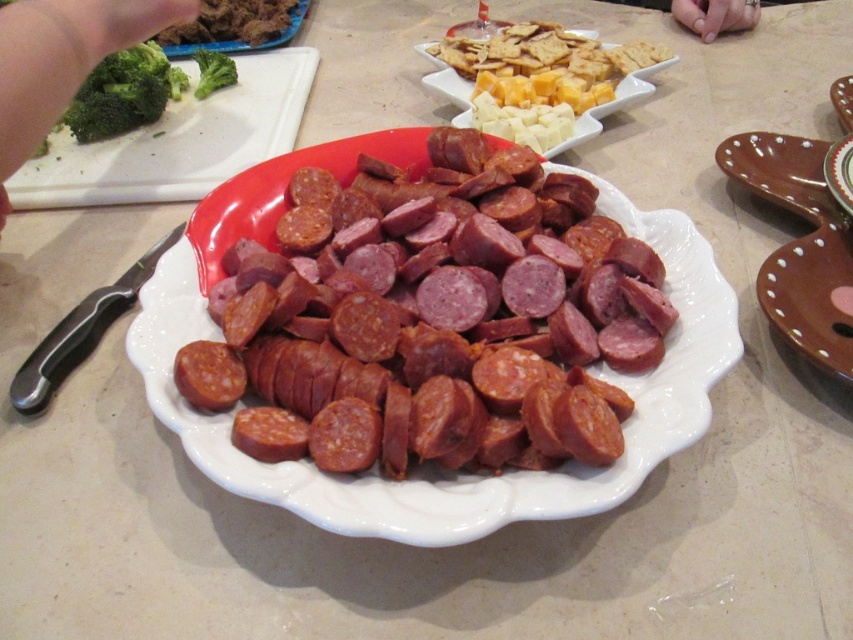
You are standing 25 inches away from the table. Can you reach the point at coordinates point (x=808, y=275) on the table without moving closer?

The distance of point (x=808, y=275) from the camera is 23.65 inches, so yes, you can reach it without moving closer since you are already 25 inches away.

You are arranging food on a table and need to place a new dish near the matte brown plate at upper left. Based on its current position, where should you place the new dish to ensure it doesn not obstruct the main plate?

The matte brown plate at upper left is located at point (235, 26), so you should place the new dish near that coordinate to avoid blocking the main plate.